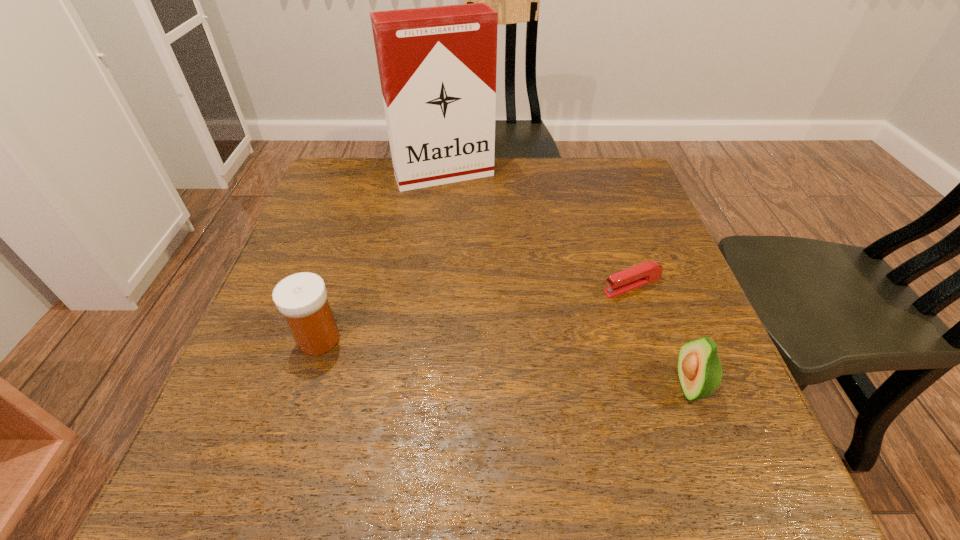
Find the location of a particular element. The width and height of the screenshot is (960, 540). vacant region located on the cut side of the nearest object is located at coordinates (462, 386).

At what (x,y) coordinates should I click in order to perform the action: click on vacant space located on the front-facing side of the farthest object. Please return your answer as a coordinate pair (x, y). Looking at the image, I should click on (496, 269).

Locate an element on the screen. This screenshot has width=960, height=540. free location located 0.130m on the front-facing side of the farthest object is located at coordinates (472, 219).

Locate an element on the screen. The width and height of the screenshot is (960, 540). vacant space located on the front-facing side of the farthest object is located at coordinates 482,238.

Image resolution: width=960 pixels, height=540 pixels. Find the location of `vacant space located on the front-facing side of the third nearest object`. vacant space located on the front-facing side of the third nearest object is located at coordinates (505, 329).

In order to click on vacant space situated on the front-facing side of the third nearest object in this screenshot , I will do `click(514, 326)`.

Image resolution: width=960 pixels, height=540 pixels. Identify the location of free space located 0.310m on the front-facing side of the third nearest object. (472, 341).

The height and width of the screenshot is (540, 960). Identify the location of object located in the far edge section of the desktop. (437, 65).

Locate an element on the screen. The height and width of the screenshot is (540, 960). object at the near edge is located at coordinates (699, 368).

Image resolution: width=960 pixels, height=540 pixels. What are the coordinates of `object that is at the left edge` in the screenshot? It's located at (301, 298).